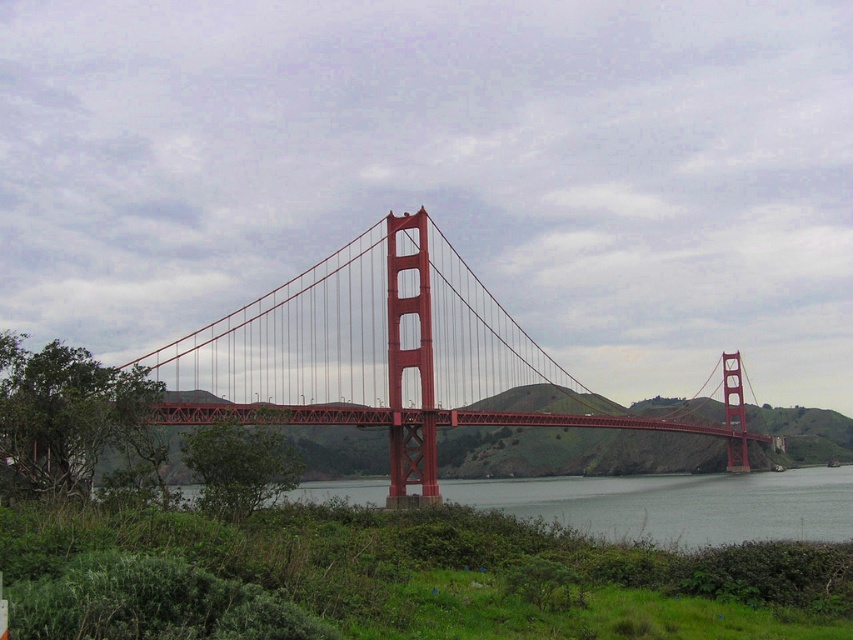
You are standing at the exact center of the image. Looking at the metallic red suspension bridge at center, can you tell me its 2D coordinates in the image?

The 2D coordinates of the metallic red suspension bridge at center are at point (397, 358).

You are a photographer planning to capture the Golden Gate Bridge. You notice the metallic red suspension bridge at center and the clear water at center in your viewfinder. Which object should you focus on if you want to highlight the larger subject in your photo?

The metallic red suspension bridge at center is larger in size than the clear water at center, so you should focus on the metallic red suspension bridge at center to highlight the larger subject in your photo.

You are standing on a viewing platform near the Golden Gate Bridge. You want to take a photo of the metallic red suspension bridge at center. If your camera can focus on objects up to 200 feet away, will you need to move closer to capture a clear photo?

The metallic red suspension bridge at center is 226.47 feet away from the viewer. Since the camera can only focus up to 200 feet, you need to move closer to ensure the bridge is within the camera range.